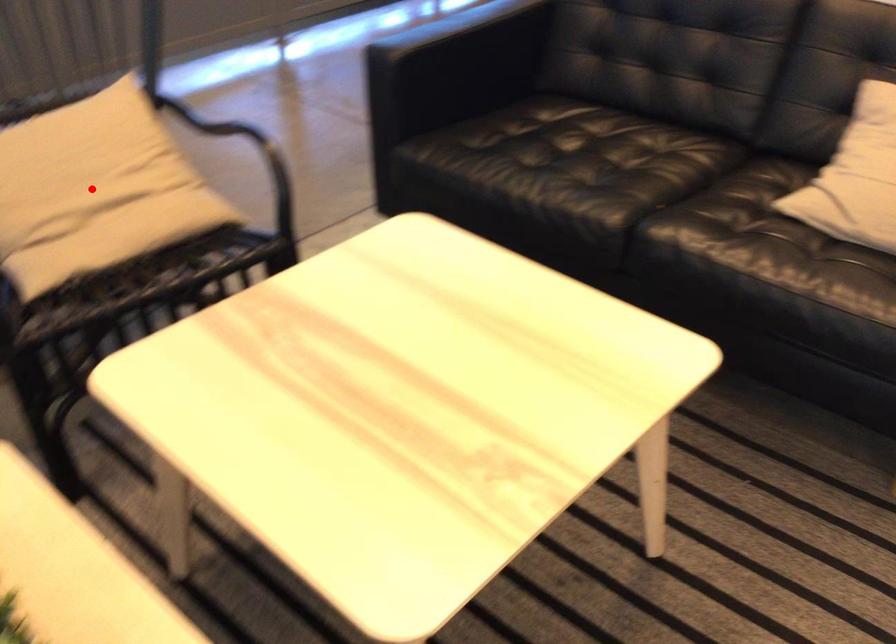
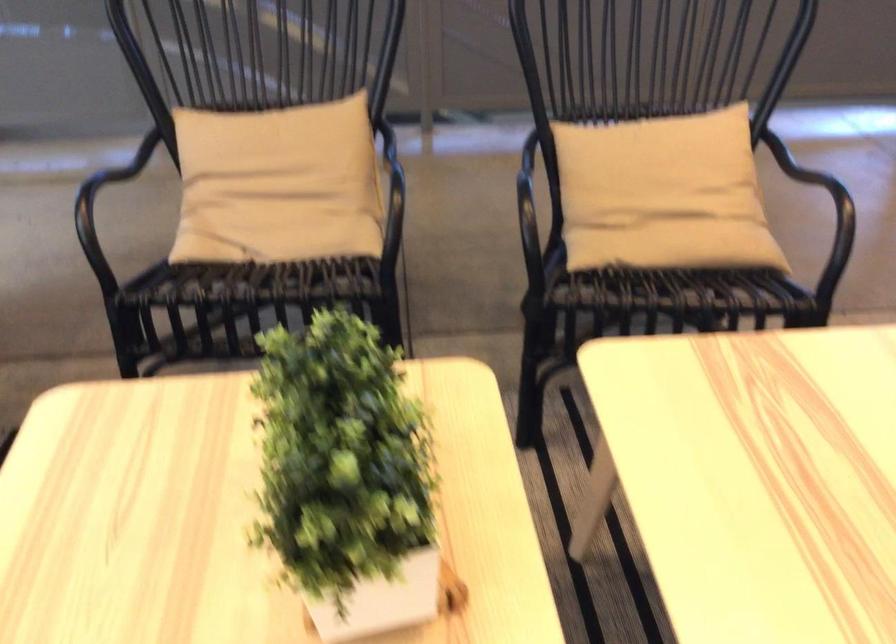
Where in the second image is the point corresponding to the highlighted location from the first image?

(662, 194)